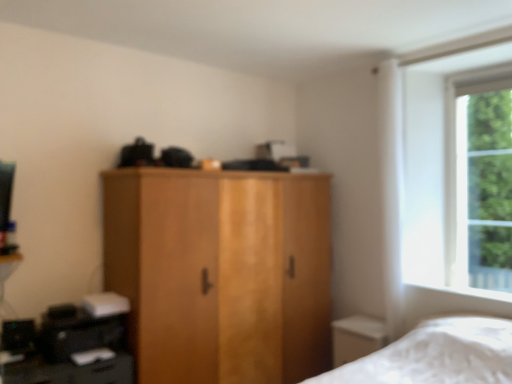
What do you see at coordinates (490, 189) in the screenshot? I see `green leafy tree at right` at bounding box center [490, 189].

Describe the element at coordinates (78, 345) in the screenshot. I see `black plastic printer at lower left` at that location.

What is the approximate width of wooden wardrobe at center?

The width of wooden wardrobe at center is 26.34 inches.

This screenshot has height=384, width=512. What are the coordinates of `green leafy tree at right` in the screenshot? It's located at (490, 189).

Based on the photo, is green leafy tree at right facing away from wooden wardrobe at center?

No, green leafy tree at right is not facing away from wooden wardrobe at center.

From a real-world perspective, is green leafy tree at right physically located above or below wooden wardrobe at center?

Clearly, from a real-world perspective, green leafy tree at right is above wooden wardrobe at center.

Is the depth of green leafy tree at right greater than that of wooden wardrobe at center?

Yes, it is.

How many degrees apart are the facing directions of green leafy tree at right and wooden wardrobe at center?

They differ by 91.7 degrees in their facing directions.

Could you tell me if wooden wardrobe at center is turned towards black plastic printer at lower left?

No, wooden wardrobe at center is not turned towards black plastic printer at lower left.

Relative to black plastic printer at lower left, is wooden wardrobe at center in front or behind?

wooden wardrobe at center is positioned farther from the viewer than black plastic printer at lower left.

There is a black plastic printer at lower left. In order to click on cupboard above it (from a real-world perspective) in this screenshot , I will do `click(221, 273)`.

Can you confirm if wooden wardrobe at center is positioned to the right of black plastic printer at lower left?

Yes.

In the scene shown: Is green leafy tree at right bigger than black plastic printer at lower left?

No.

Is green leafy tree at right not inside black plastic printer at lower left?

Absolutely, green leafy tree at right is external to black plastic printer at lower left.

From a real-world perspective, is green leafy tree at right positioned above or below black plastic printer at lower left?

In terms of real-world spatial position, green leafy tree at right is above black plastic printer at lower left.

Identify the location of tree above the black plastic printer at lower left (from a real-world perspective). This screenshot has height=384, width=512. (490, 189).

Locate an element on the screen. The image size is (512, 384). computer desk that is under the wooden wardrobe at center (from a real-world perspective) is located at coordinates (78, 345).

From the image's perspective, which is below, black plastic printer at lower left or wooden wardrobe at center?

black plastic printer at lower left, from the image's perspective.

Considering the relative positions of black plastic printer at lower left and wooden wardrobe at center in the image provided, is black plastic printer at lower left to the left or to the right of wooden wardrobe at center?

Based on their positions, black plastic printer at lower left is located to the left of wooden wardrobe at center.

Can you confirm if black plastic printer at lower left is wider than green leafy tree at right?

Yes, black plastic printer at lower left is wider than green leafy tree at right.

Does black plastic printer at lower left contain green leafy tree at right?

No, green leafy tree at right is located outside of black plastic printer at lower left.

The height and width of the screenshot is (384, 512). What are the coordinates of `computer desk in front of the green leafy tree at right` in the screenshot? It's located at (78, 345).

Which is more to the left, black plastic printer at lower left or green leafy tree at right?

From the viewer's perspective, black plastic printer at lower left appears more on the left side.

Can you tell me how much wooden wardrobe at center and green leafy tree at right differ in facing direction?

wooden wardrobe at center and green leafy tree at right are facing 91.7 degrees away from each other.

Considering the relative sizes of wooden wardrobe at center and green leafy tree at right in the image provided, is wooden wardrobe at center smaller than green leafy tree at right?

Actually, wooden wardrobe at center might be larger than green leafy tree at right.

Locate an element on the screen. The height and width of the screenshot is (384, 512). tree above the wooden wardrobe at center (from the image's perspective) is located at coordinates (490, 189).

You are a GUI agent. You are given a task and a screenshot of the screen. Output one action in this format:
    pyautogui.click(x=<x>, y=<y>)
    Task: Click on the cupboard on the left of green leafy tree at right
    The image size is (512, 384).
    Given the screenshot: What is the action you would take?
    pyautogui.click(x=221, y=273)

Find the location of a particular element. Image resolution: width=512 pixels, height=384 pixels. cupboard that is above the black plastic printer at lower left (from the image's perspective) is located at coordinates (221, 273).

Based on their spatial positions, is black plastic printer at lower left or wooden wardrobe at center further from green leafy tree at right?

black plastic printer at lower left is positioned further to the anchor green leafy tree at right.

From the picture: Considering their positions, is black plastic printer at lower left positioned closer to wooden wardrobe at center than green leafy tree at right?

Based on the image, black plastic printer at lower left appears to be nearer to wooden wardrobe at center.

Which object lies further to the anchor point wooden wardrobe at center, green leafy tree at right or black plastic printer at lower left?

Among the two, green leafy tree at right is located further to wooden wardrobe at center.

Based on their spatial positions, is green leafy tree at right or wooden wardrobe at center closer to black plastic printer at lower left?

wooden wardrobe at center is positioned closer to the anchor black plastic printer at lower left.

Considering their positions, is wooden wardrobe at center positioned closer to green leafy tree at right than black plastic printer at lower left?

wooden wardrobe at center is positioned closer to the anchor green leafy tree at right.

Which object lies nearer to the anchor point black plastic printer at lower left, wooden wardrobe at center or green leafy tree at right?

wooden wardrobe at center.

Identify the location of cupboard between black plastic printer at lower left and green leafy tree at right from left to right. (221, 273).